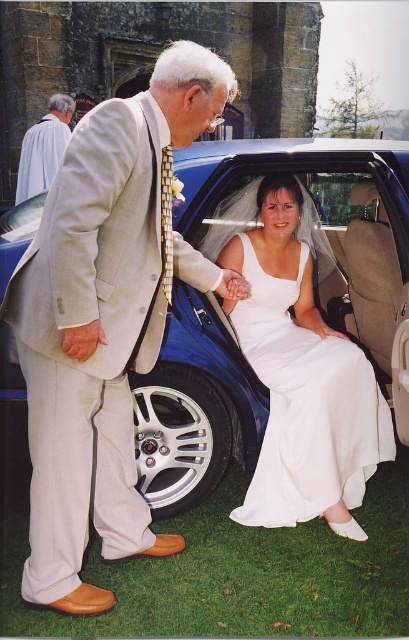
You are a photographer at the wedding. You need to position yourself so that both the blue metallic car at center and the white satin dress at center are visible in your shot. Given that the car is larger than the dress, which object should you focus on to ensure both are in frame?

Since the blue metallic car at center is larger in size than the white satin dress at center, you should focus on the blue metallic car at center to ensure both are in frame as it takes up more space.

You are a photographer at a wedding. You need to position yourself so that you can capture both the white satin dress at center and the light gray suit at upper left in the same frame. Based on their positions, where should you stand relative to the two subjects?

You should stand below the white satin dress at center to include both it and the light gray suit at upper left in the frame, as the white satin dress at center is positioned below the light gray suit at upper left.

You are standing at the point with coordinates point [350,244] and want to move to the point with coordinates point [143,342]. Which direction should you move to get closer to the viewer?

You should move towards point [143,342] because it is closer to the viewer than point [350,244].